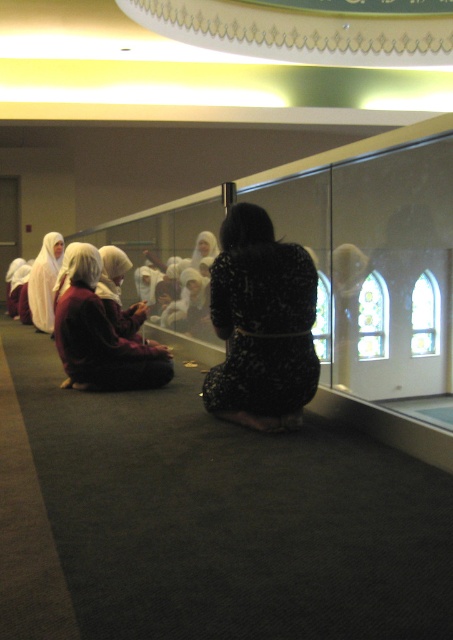
The width and height of the screenshot is (453, 640). What do you see at coordinates (261, 324) in the screenshot?
I see `black textured dress at center` at bounding box center [261, 324].

Which is more to the left, black textured dress at center or dark brown fabric hijab at lower left?

dark brown fabric hijab at lower left is more to the left.

What do you see at coordinates (261, 324) in the screenshot?
I see `black textured dress at center` at bounding box center [261, 324].

At what (x,y) coordinates should I click in order to perform the action: click on black textured dress at center. Please return your answer as a coordinate pair (x, y). This screenshot has width=453, height=640. Looking at the image, I should click on (261, 324).

Is the position of dark brown fabric hijab at lower left more distant than that of white matte hijab at left?

No, it is not.

Based on the photo, can you confirm if dark brown fabric hijab at lower left is shorter than white matte hijab at left?

Yes, dark brown fabric hijab at lower left is shorter than white matte hijab at left.

This screenshot has height=640, width=453. What are the coordinates of `dark brown fabric hijab at lower left` in the screenshot? It's located at pyautogui.click(x=99, y=333).

Can you confirm if black textured dress at center is smaller than white matte hijab at left?

Indeed, black textured dress at center has a smaller size compared to white matte hijab at left.

Between point (261, 403) and point (44, 291), which one is positioned in front?

Positioned in front is point (261, 403).

This screenshot has height=640, width=453. Identify the location of black textured dress at center. (261, 324).

Where is `black textured dress at center`? black textured dress at center is located at coordinates (261, 324).